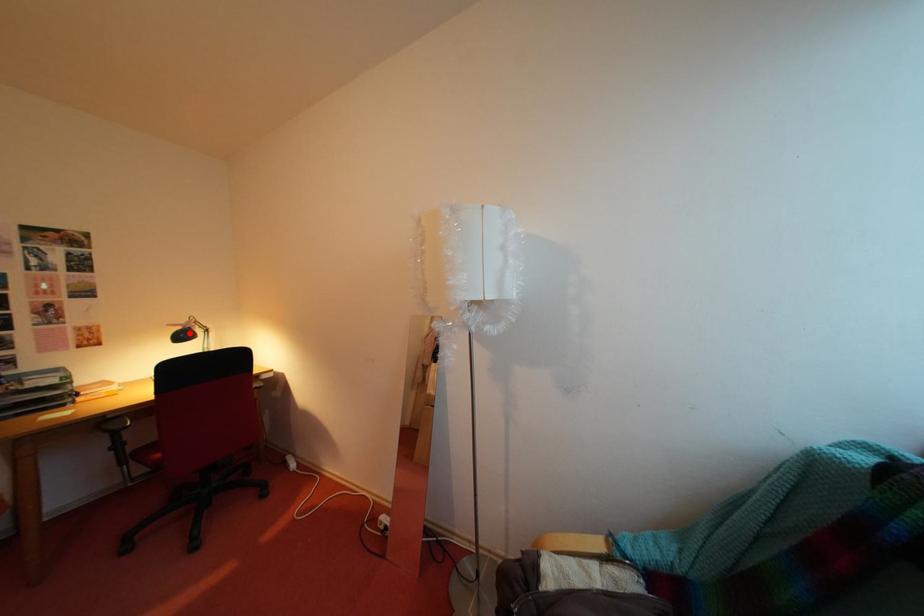
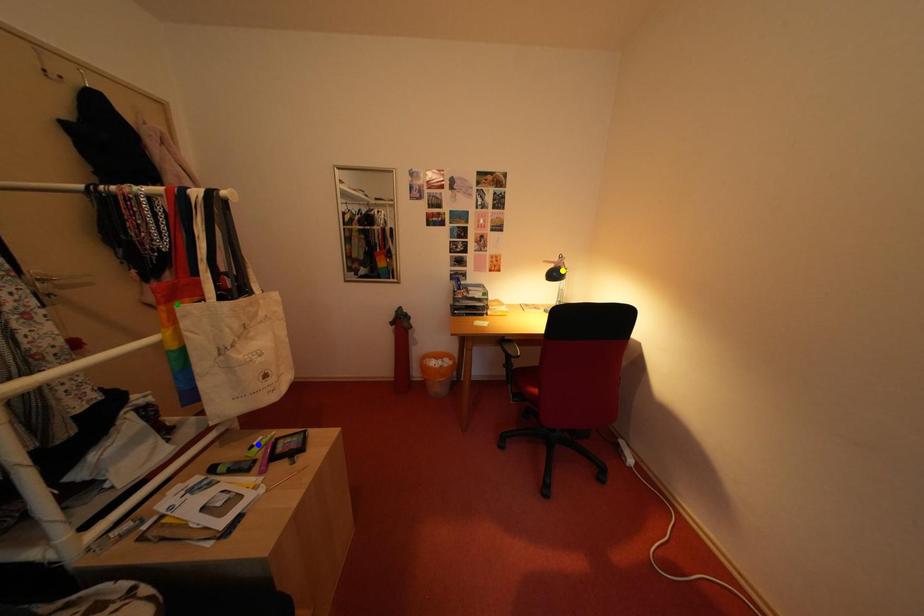
Question: I am providing you with two images of the same scene from different viewpoints. A red point is marked on the first image. You are given multiple points on the second image. Which point in image 2 is actually the same real-world point as the red point in image 1?

Choices:
 (A) blue point
 (B) green point
 (C) yellow point

Answer: (C)